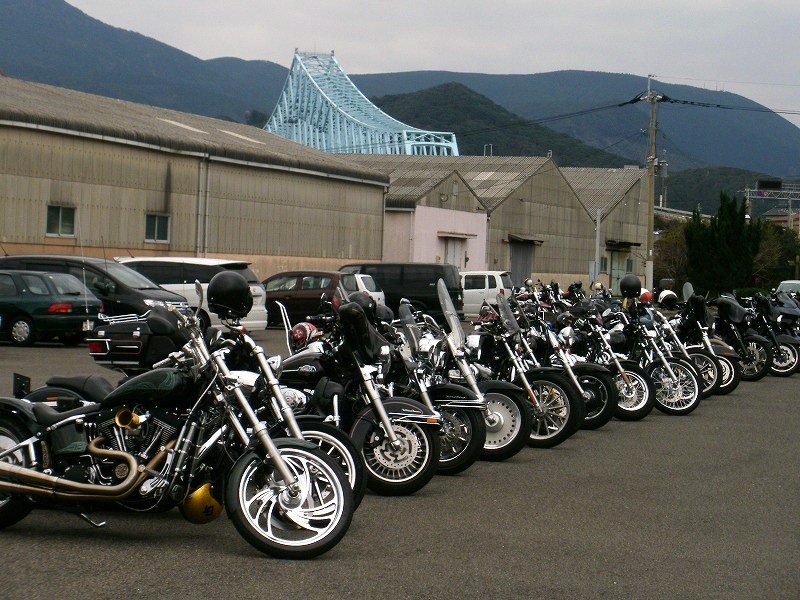
I want to click on seat, so click(94, 382).